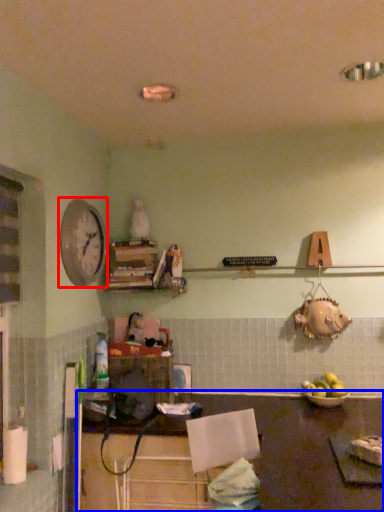
Question: Which object is closer to the camera taking this photo, clock (highlighted by a red box) or table (highlighted by a blue box)?

Choices:
 (A) clock
 (B) table

Answer: (B)